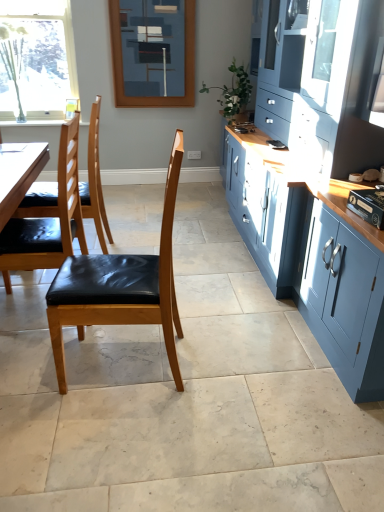
Question: Is black leather chair at left, positioned as the 3th chair in front-to-back order, not close to matte black chair at left, placed as the second chair when sorted from front to back?

Choices:
 (A) no
 (B) yes

Answer: (A)

Question: Is black leather chair at left, positioned as the 3th chair in front-to-back order, closer to the viewer compared to matte black chair at left, arranged as the 2th chair when viewed from the back?

Choices:
 (A) yes
 (B) no

Answer: (B)

Question: Is black leather chair at left, positioned as the 3th chair in front-to-back order, outside of matte black chair at left, arranged as the 2th chair when viewed from the back?

Choices:
 (A) no
 (B) yes

Answer: (B)

Question: Is black leather chair at left, positioned as the 3th chair in front-to-back order, to the left of matte black chair at left, arranged as the 2th chair when viewed from the back, from the viewer's perspective?

Choices:
 (A) no
 (B) yes

Answer: (B)

Question: From a real-world perspective, is black leather chair at left, positioned as the 3th chair in front-to-back order, located higher than matte black chair at left, arranged as the 2th chair when viewed from the back?

Choices:
 (A) yes
 (B) no

Answer: (A)

Question: Can you confirm if black leather chair at left, positioned as the 3th chair in front-to-back order, is positioned to the right of matte black chair at left, arranged as the 2th chair when viewed from the back?

Choices:
 (A) yes
 (B) no

Answer: (B)

Question: Is black leather chair at left, positioned as the 3th chair in front-to-back order, positioned behind blue painted wood frame at upper center?

Choices:
 (A) yes
 (B) no

Answer: (B)

Question: Is black leather chair at left, which ranks as the 1th chair in back-to-front order, positioned with its back to blue painted wood frame at upper center?

Choices:
 (A) yes
 (B) no

Answer: (B)

Question: Is black leather chair at left, positioned as the 3th chair in front-to-back order, wider than blue painted wood frame at upper center?

Choices:
 (A) no
 (B) yes

Answer: (B)

Question: Is black leather chair at left, positioned as the 3th chair in front-to-back order, oriented towards blue painted wood frame at upper center?

Choices:
 (A) no
 (B) yes

Answer: (A)

Question: Considering the relative sizes of black leather chair at left, positioned as the 3th chair in front-to-back order, and blue painted wood frame at upper center in the image provided, is black leather chair at left, positioned as the 3th chair in front-to-back order, bigger than blue painted wood frame at upper center?

Choices:
 (A) no
 (B) yes

Answer: (B)

Question: Considering the relative positions of black leather chair at left, which ranks as the 1th chair in back-to-front order, and blue painted wood frame at upper center in the image provided, is black leather chair at left, which ranks as the 1th chair in back-to-front order, to the left of blue painted wood frame at upper center from the viewer's perspective?

Choices:
 (A) no
 (B) yes

Answer: (B)

Question: Is matte blue cabinet at right at the right side of matte black chair at left, placed as the second chair when sorted from front to back?

Choices:
 (A) no
 (B) yes

Answer: (B)